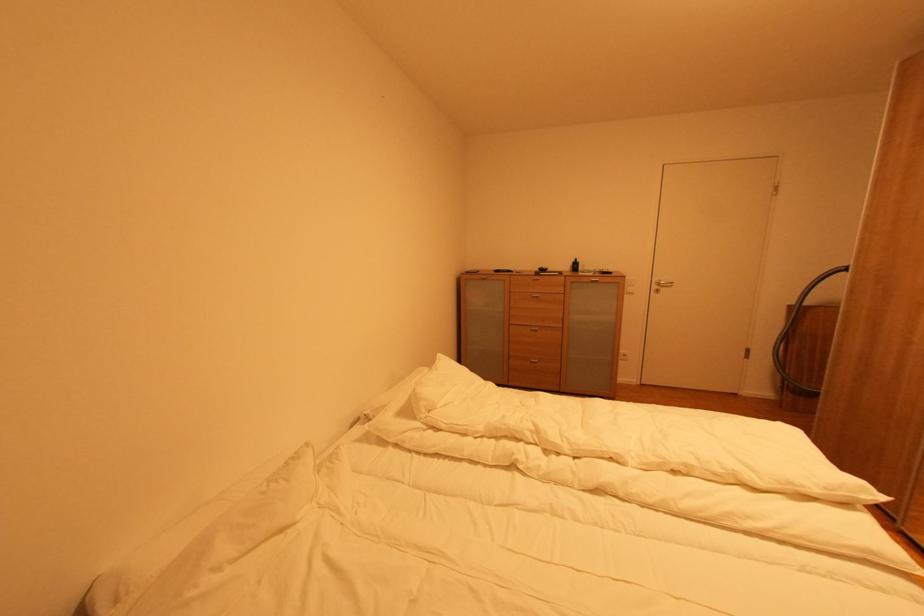
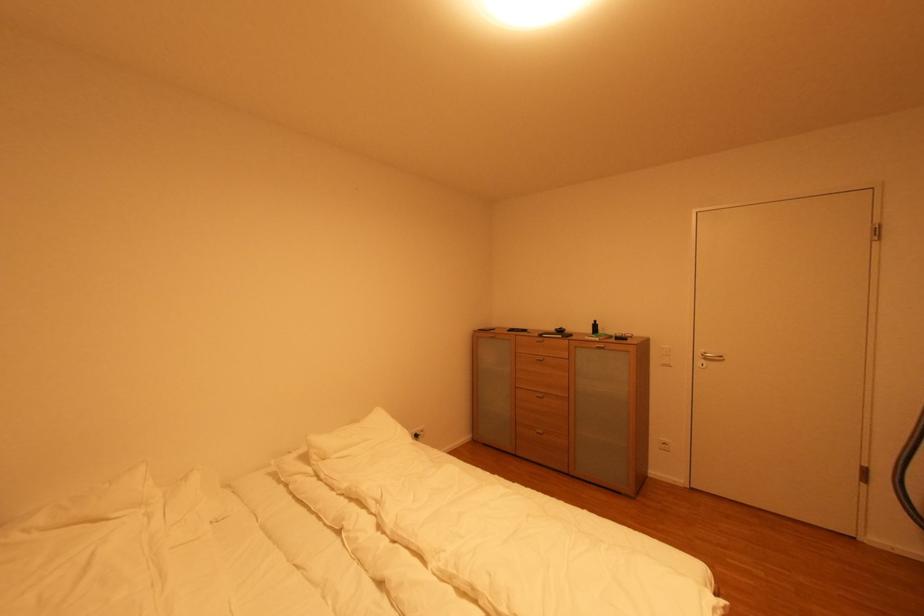
In the second image, find the point that corresponds to point (701, 476) in the first image.

(485, 606)